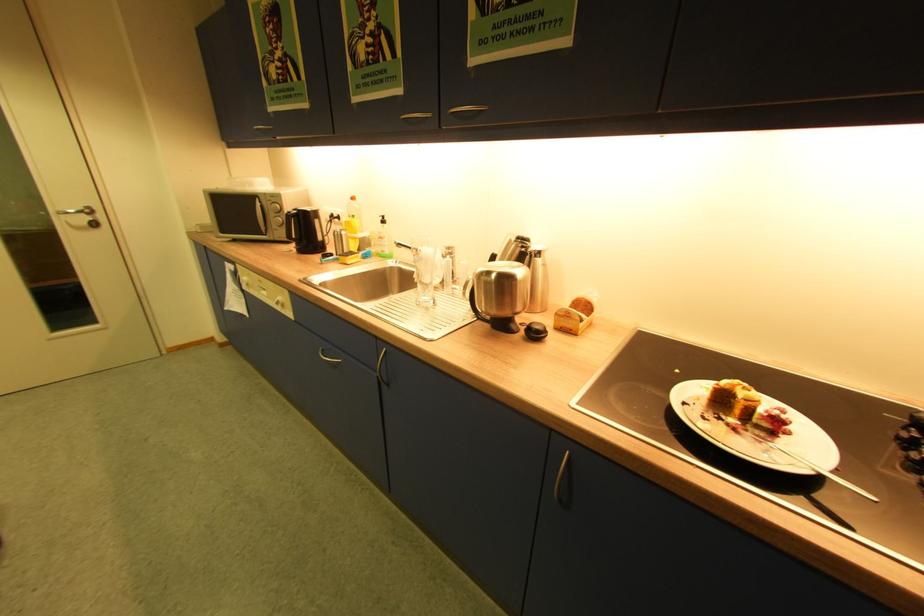
Where would you lift the small cardboard box? Please return your answer as a coordinate pair (x, y).

(574, 315)